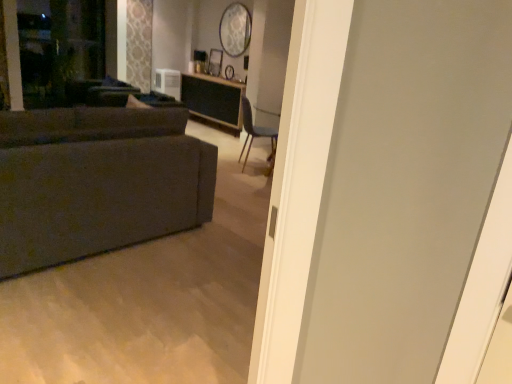
Question: From the image's perspective, would you say transparent glass screen door at upper left is positioned over wooden table at center?

Choices:
 (A) no
 (B) yes

Answer: (B)

Question: Can wooden table at center be found inside transparent glass screen door at upper left?

Choices:
 (A) no
 (B) yes

Answer: (A)

Question: Is transparent glass screen door at upper left to the right of wooden table at center from the viewer's perspective?

Choices:
 (A) no
 (B) yes

Answer: (A)

Question: Considering the relative positions of transparent glass screen door at upper left and wooden table at center in the image provided, is transparent glass screen door at upper left behind wooden table at center?

Choices:
 (A) no
 (B) yes

Answer: (A)

Question: Could you tell me if transparent glass screen door at upper left is facing wooden table at center?

Choices:
 (A) yes
 (B) no

Answer: (B)

Question: In terms of height, does textured gray couch at left look taller or shorter compared to wooden table at center?

Choices:
 (A) tall
 (B) short

Answer: (A)

Question: In terms of size, does textured gray couch at left appear bigger or smaller than wooden table at center?

Choices:
 (A) small
 (B) big

Answer: (B)

Question: In the image, is textured gray couch at left positioned in front of or behind wooden table at center?

Choices:
 (A) behind
 (B) front

Answer: (B)

Question: Is textured gray couch at left inside the boundaries of wooden table at center, or outside?

Choices:
 (A) outside
 (B) inside

Answer: (A)

Question: From a real-world perspective, relative to white plastic air conditioner at upper center, is wooden table at center vertically above or below?

Choices:
 (A) above
 (B) below

Answer: (B)

Question: In the image, is wooden table at center on the left side or the right side of white plastic air conditioner at upper center?

Choices:
 (A) right
 (B) left

Answer: (A)

Question: Looking at their shapes, would you say wooden table at center is wider or thinner than white plastic air conditioner at upper center?

Choices:
 (A) thin
 (B) wide

Answer: (B)

Question: Considering the positions of wooden table at center and white plastic air conditioner at upper center in the image, is wooden table at center taller or shorter than white plastic air conditioner at upper center?

Choices:
 (A) short
 (B) tall

Answer: (B)

Question: Based on their positions, is transparent glass screen door at upper left located to the left or right of textured gray couch at left?

Choices:
 (A) right
 (B) left

Answer: (B)

Question: From the image's perspective, is transparent glass screen door at upper left positioned above or below textured gray couch at left?

Choices:
 (A) below
 (B) above

Answer: (B)